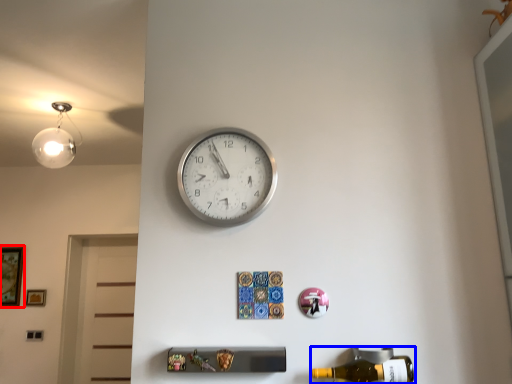
Question: Which point is closer to the camera, picture frame (highlighted by a red box) or beer bottle (highlighted by a blue box)?

Choices:
 (A) picture frame
 (B) beer bottle

Answer: (B)